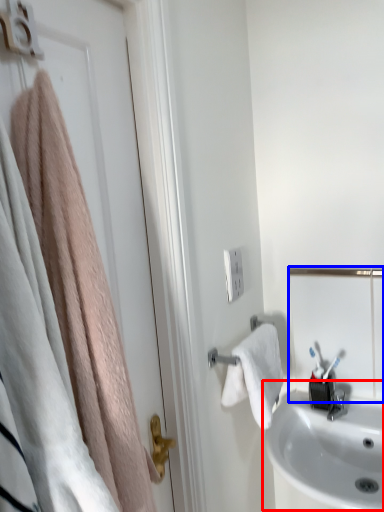
Question: Which of the following is the closest to the observer, sink (highlighted by a red box) or mirror (highlighted by a blue box)?

Choices:
 (A) sink
 (B) mirror

Answer: (A)